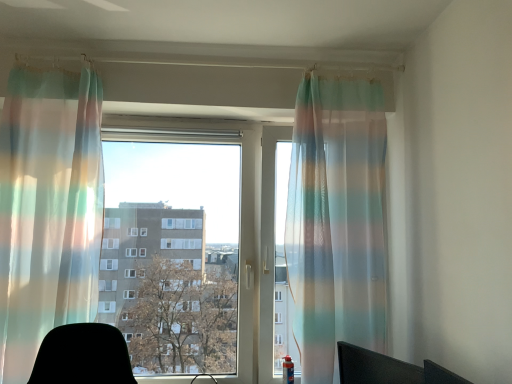
Question: Should I look upward or downward to see black matte computer chair at lower right?

Choices:
 (A) up
 (B) down

Answer: (B)

Question: Is transparent fabric at center to the right of translucent rainbow striped curtain at left, the 2th curtain viewed from the right, from the viewer's perspective?

Choices:
 (A) yes
 (B) no

Answer: (A)

Question: Can you confirm if transparent fabric at center is taller than translucent rainbow striped curtain at left, the 2th curtain viewed from the right?

Choices:
 (A) yes
 (B) no

Answer: (B)

Question: Is transparent fabric at center further to camera compared to translucent rainbow striped curtain at left, the 2th curtain viewed from the right?

Choices:
 (A) no
 (B) yes

Answer: (B)

Question: Is translucent rainbow striped curtain at left, the 2th curtain viewed from the right, surrounded by transparent fabric at center?

Choices:
 (A) no
 (B) yes

Answer: (A)

Question: Can you confirm if transparent fabric at center is bigger than translucent rainbow striped curtain at left, which is the 1th curtain from left to right?

Choices:
 (A) no
 (B) yes

Answer: (B)

Question: Is the surface of transparent fabric at center in direct contact with translucent rainbow striped curtain at left, the 2th curtain viewed from the right?

Choices:
 (A) no
 (B) yes

Answer: (A)

Question: From a real-world perspective, is translucent rainbow striped curtain at left, which is the 1th curtain from left to right, over translucent striped curtain at center, which appears as the 1th curtain when viewed from the right?

Choices:
 (A) no
 (B) yes

Answer: (B)

Question: Is translucent rainbow striped curtain at left, which is the 1th curtain from left to right, looking in the opposite direction of translucent striped curtain at center, which appears as the 1th curtain when viewed from the right?

Choices:
 (A) yes
 (B) no

Answer: (B)

Question: Is translucent rainbow striped curtain at left, the 2th curtain viewed from the right, shorter than translucent striped curtain at center, positioned as the second curtain in left-to-right order?

Choices:
 (A) yes
 (B) no

Answer: (A)

Question: Is translucent rainbow striped curtain at left, which is the 1th curtain from left to right, not inside translucent striped curtain at center, which appears as the 1th curtain when viewed from the right?

Choices:
 (A) no
 (B) yes

Answer: (B)

Question: Is translucent rainbow striped curtain at left, the 2th curtain viewed from the right, to the left of translucent striped curtain at center, positioned as the second curtain in left-to-right order, from the viewer's perspective?

Choices:
 (A) no
 (B) yes

Answer: (B)

Question: Does translucent rainbow striped curtain at left, the 2th curtain viewed from the right, have a greater height compared to translucent striped curtain at center, which appears as the 1th curtain when viewed from the right?

Choices:
 (A) no
 (B) yes

Answer: (A)

Question: From a real-world perspective, is translucent rainbow striped curtain at left, which is the 1th curtain from left to right, located higher than black matte computer chair at lower right?

Choices:
 (A) yes
 (B) no

Answer: (A)